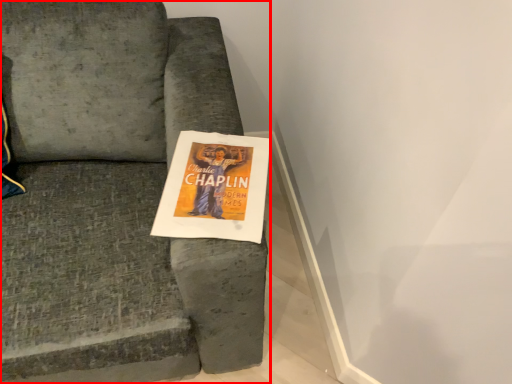
Question: Observing the image, what is the correct spatial positioning of chair (annotated by the red box) in reference to flyer?

Choices:
 (A) left
 (B) right

Answer: (A)